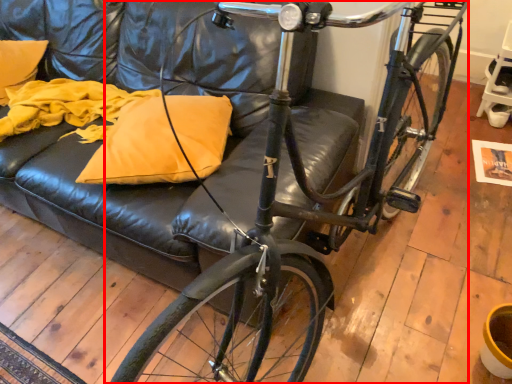
Question: From the image's perspective, where is bicycle (annotated by the red box) located relative to pillow?

Choices:
 (A) above
 (B) below

Answer: (B)